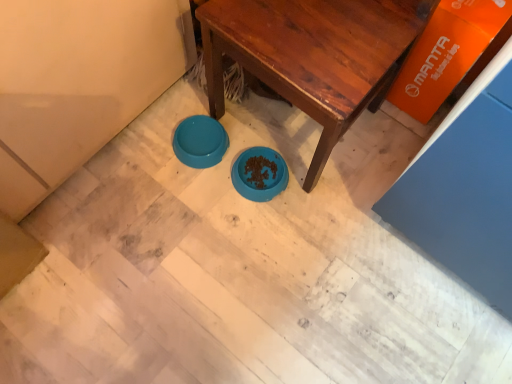
Question: Should I look upward or downward to see teal plastic bowl at center?

Choices:
 (A) down
 (B) up

Answer: (B)

Question: Can we say teal plastic bowl at center lies outside wooden table at center?

Choices:
 (A) yes
 (B) no

Answer: (A)

Question: Is teal plastic bowl at center at the left side of wooden table at center?

Choices:
 (A) yes
 (B) no

Answer: (A)

Question: Is wooden table at center at the back of teal plastic bowl at center?

Choices:
 (A) yes
 (B) no

Answer: (A)

Question: Considering the relative sizes of teal plastic bowl at center and wooden table at center in the image provided, is teal plastic bowl at center taller than wooden table at center?

Choices:
 (A) no
 (B) yes

Answer: (A)

Question: Does teal plastic bowl at center appear on the right side of wooden table at center?

Choices:
 (A) yes
 (B) no

Answer: (B)

Question: Can you confirm if teal plastic bowl at center is wider than wooden table at center?

Choices:
 (A) yes
 (B) no

Answer: (B)

Question: Is wooden table at center positioned with its back to teal plastic bowl at center?

Choices:
 (A) yes
 (B) no

Answer: (B)

Question: Does wooden table at center touch teal plastic bowl at center?

Choices:
 (A) yes
 (B) no

Answer: (B)

Question: From the image's perspective, would you say wooden table at center is positioned over teal plastic bowl at center?

Choices:
 (A) yes
 (B) no

Answer: (A)

Question: Is wooden table at center positioned behind teal plastic bowl at center?

Choices:
 (A) no
 (B) yes

Answer: (A)

Question: Does wooden table at center appear on the left side of teal plastic bowl at center?

Choices:
 (A) yes
 (B) no

Answer: (B)

Question: Is wooden table at center to the right of teal plastic bowl at center from the viewer's perspective?

Choices:
 (A) no
 (B) yes

Answer: (B)

Question: In terms of width, does wooden table at center look wider or thinner when compared to teal plastic bowl at center?

Choices:
 (A) thin
 (B) wide

Answer: (B)